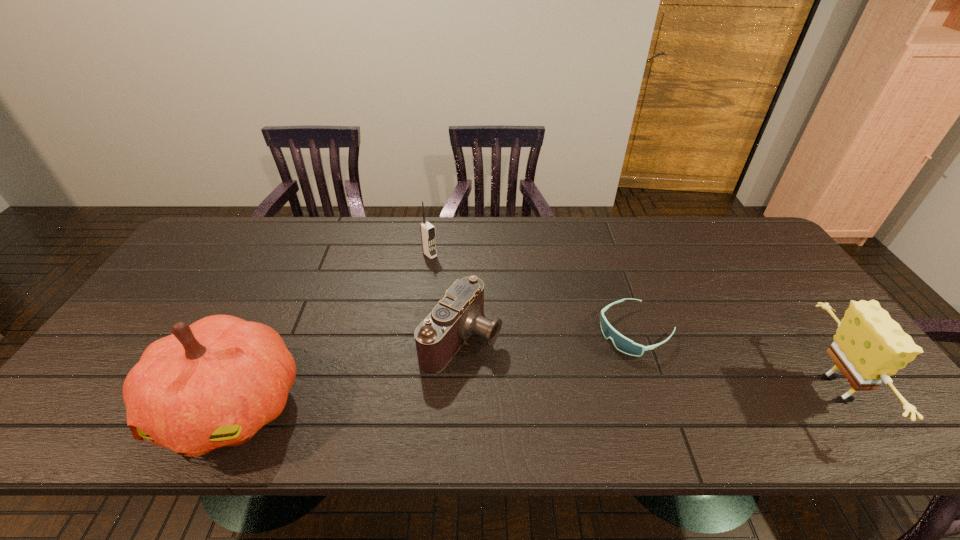
What are the coordinates of `free spot on the desktop that is between the tallest object and the rightmost object and is positioned on the front-facing side of the goggles` in the screenshot? It's located at (519, 397).

At what (x,y) coordinates should I click in order to perform the action: click on vacant space on the desktop that is between the leftmost object and the rightmost object and is positioned on the front-facing side of the camera. Please return your answer as a coordinate pair (x, y). Looking at the image, I should click on (x=589, y=396).

This screenshot has height=540, width=960. Find the location of `free spot on the desktop that is between the tallest object and the rightmost object and is positioned on the front-facing side of the third tallest object`. free spot on the desktop that is between the tallest object and the rightmost object and is positioned on the front-facing side of the third tallest object is located at coordinates (604, 395).